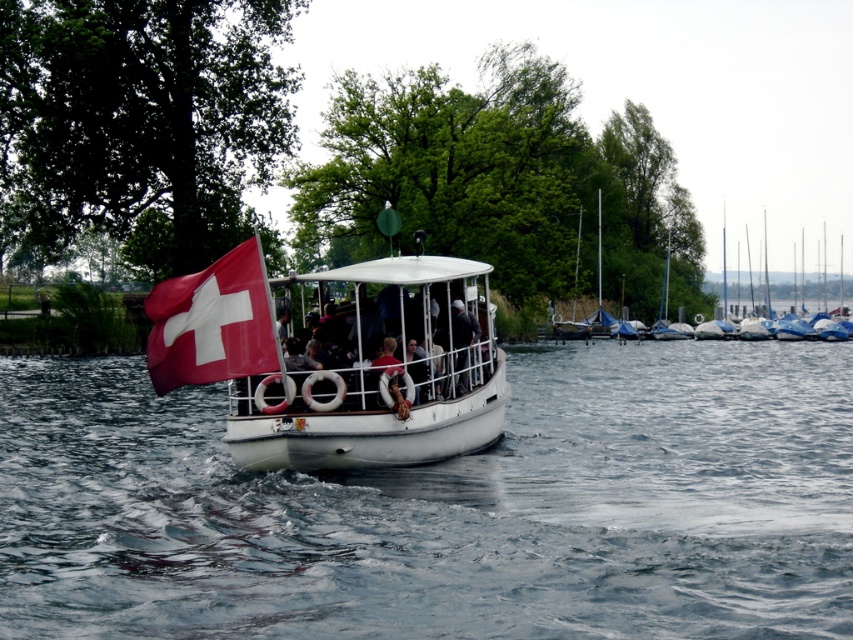
Question: Based on their relative distances, which object is farther from the white smooth water at center?

Choices:
 (A) red matte flag at center
 (B) white glossy sailboats at right
 (C) white matte boat at center

Answer: (B)

Question: Is white glossy sailboats at right to the left of red matte flag at center from the viewer's perspective?

Choices:
 (A) yes
 (B) no

Answer: (B)

Question: Does white smooth water at center have a smaller size compared to white matte boat at center?

Choices:
 (A) no
 (B) yes

Answer: (A)

Question: Which point appears closest to the camera in this image?

Choices:
 (A) (213, 296)
 (B) (688, 260)

Answer: (A)

Question: Can you confirm if white glossy sailboats at right is wider than red matte flag at center?

Choices:
 (A) yes
 (B) no

Answer: (A)

Question: Which object is the farthest from the white smooth water at center?

Choices:
 (A) white matte boat at center
 (B) white glossy sailboats at right
 (C) red matte flag at center

Answer: (B)